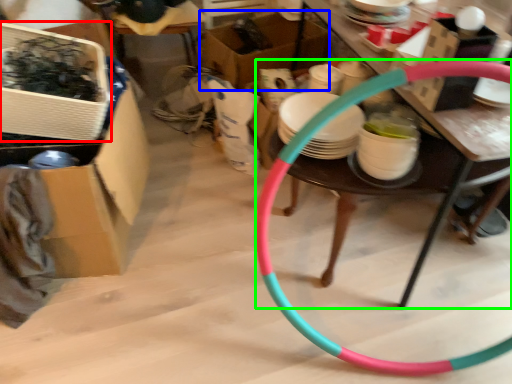
Question: Which object is the closest to the box (highlighted by a red box)? Choose among these: box (highlighted by a blue box) or table (highlighted by a green box).

Choices:
 (A) box
 (B) table

Answer: (B)